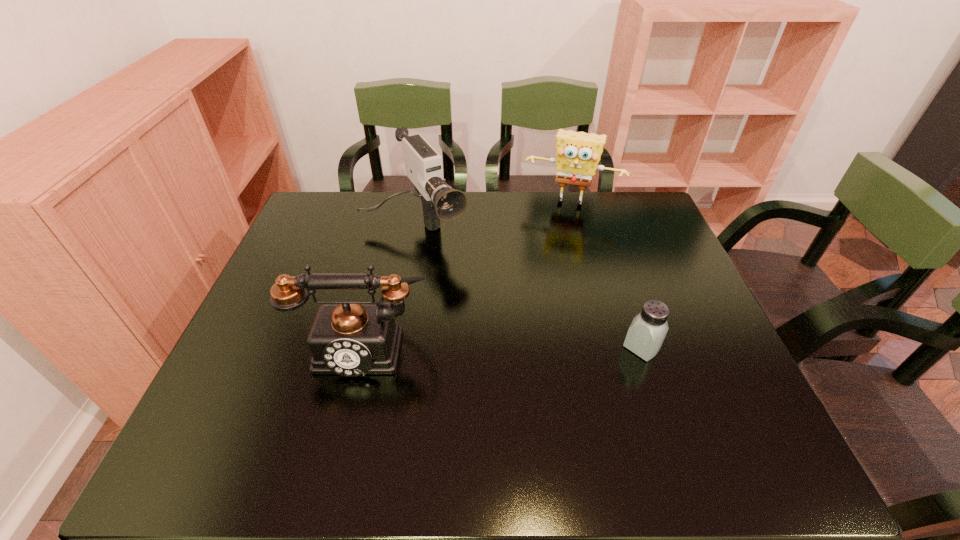
Identify the location of telephone. (348, 338).

Where is `the shortest object`? The width and height of the screenshot is (960, 540). the shortest object is located at coordinates (645, 336).

Identify the location of camcorder. (423, 164).

Where is `sponge`? This screenshot has height=540, width=960. sponge is located at coordinates (578, 153).

Image resolution: width=960 pixels, height=540 pixels. In order to click on vacant space located 0.060m on the front of the telephone at the rotary dial in this screenshot , I will do `click(350, 405)`.

Find the location of `vacant space situated 0.180m on the left of the shortest object`. vacant space situated 0.180m on the left of the shortest object is located at coordinates (545, 347).

What are the coordinates of `free spot located 0.110m on the recording direction of the camcorder` in the screenshot? It's located at point(453,281).

At what (x,y) coordinates should I click in order to perform the action: click on free space located on the recording direction of the camcorder. Please return your answer as a coordinate pair (x, y). Image resolution: width=960 pixels, height=540 pixels. Looking at the image, I should click on (503, 353).

Where is `vacant space situated on the recording direction of the camcorder`? vacant space situated on the recording direction of the camcorder is located at coordinates (483, 324).

You are a GUI agent. You are given a task and a screenshot of the screen. Output one action in this format:
    pyautogui.click(x=<x>, y=<y>)
    Task: Click on the free space located on the face of the sponge
    This screenshot has width=960, height=540.
    Given the screenshot: What is the action you would take?
    pyautogui.click(x=556, y=222)